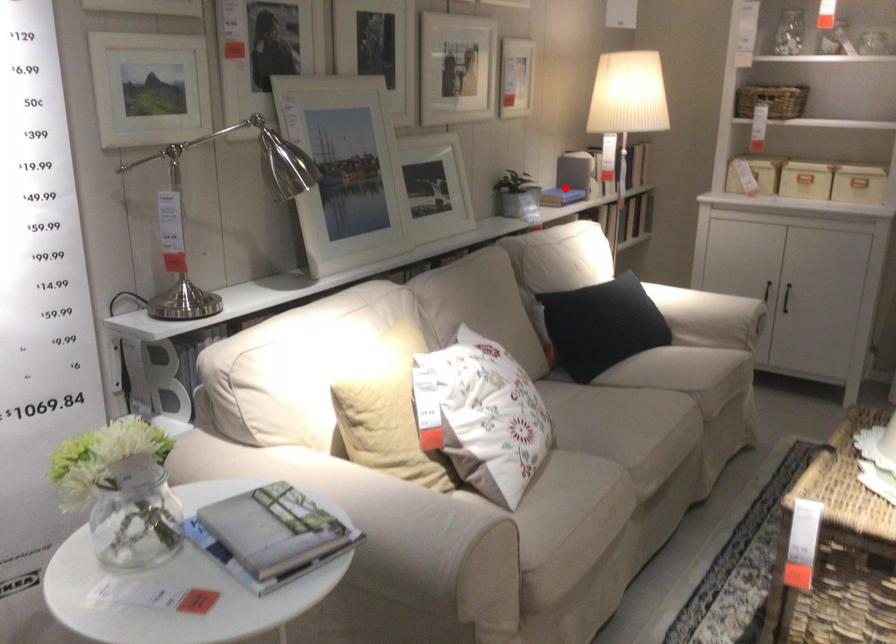
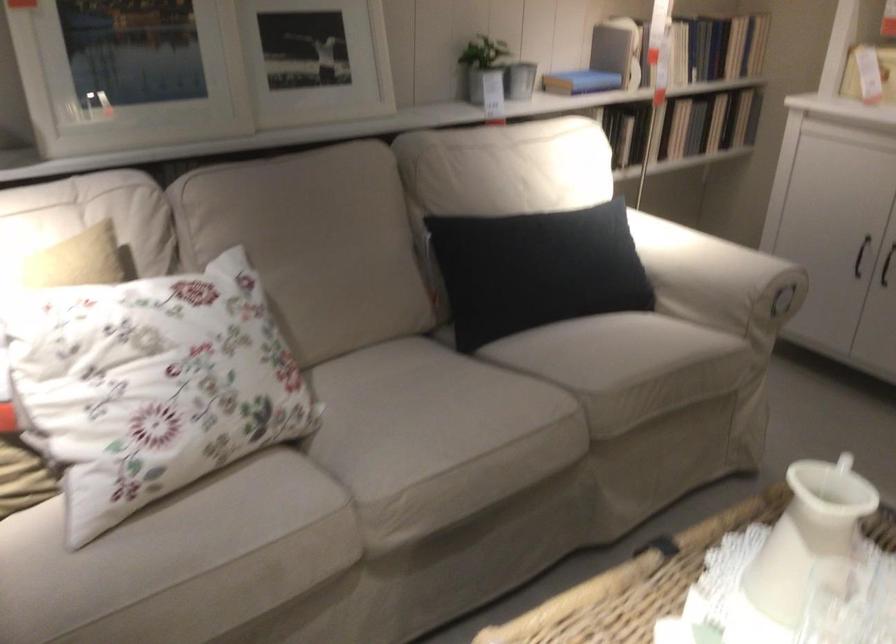
Question: I am providing you with two images of the same scene from different viewpoints. A red point is shown in image1. For the corresponding object point in image2, is it positioned nearer or farther from the camera?

Choices:
 (A) Nearer
 (B) Farther

Answer: (A)